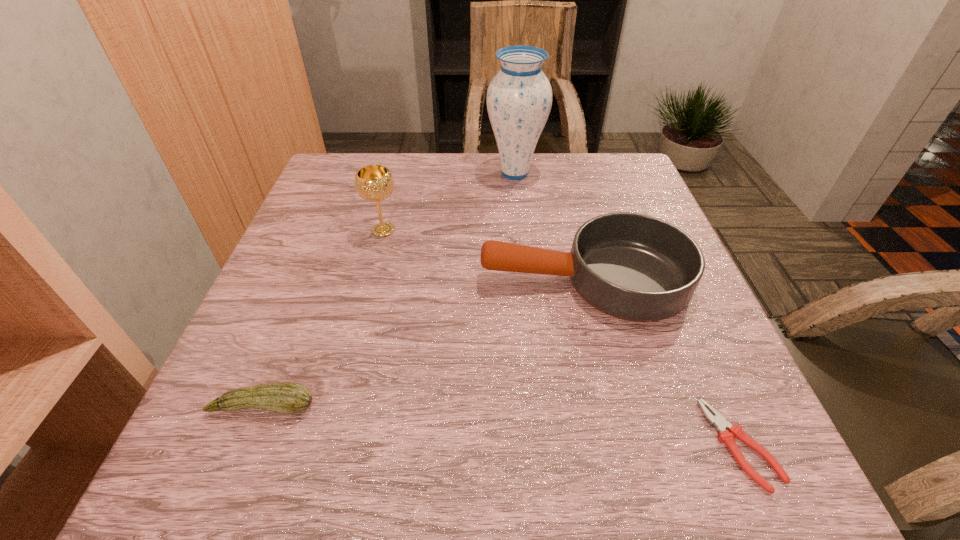
Where is `free spot between the third tallest object and the farthest object`? The image size is (960, 540). free spot between the third tallest object and the farthest object is located at coordinates (549, 226).

Locate an element on the screen. This screenshot has height=540, width=960. object that stands as the closest to the pliers is located at coordinates (635, 267).

Locate which object is the fourth closest to the tallest object. Please provide its 2D coordinates. Your answer should be formatted as a tuple, i.e. [(x, y)], where the tuple contains the x and y coordinates of a point satisfying the conditions above.

[(283, 397)]

This screenshot has height=540, width=960. Identify the location of vacant region that satisfies the following two spatial constraints: 1. at the stem end of the fourth tallest object; 2. on the left side of the pliers. (248, 444).

Locate an element on the screen. The image size is (960, 540). free space that satisfies the following two spatial constraints: 1. on the handle side of the pliers; 2. on the right side of the pan is located at coordinates (624, 444).

Find the location of a particular element. free space that satisfies the following two spatial constraints: 1. on the front side of the shortest object; 2. on the left side of the chalice is located at coordinates (328, 444).